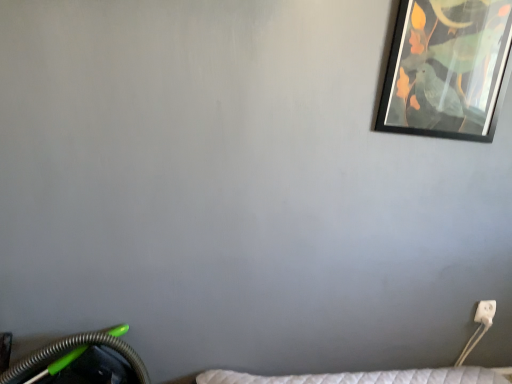
Question: Considering the relative sizes of white plastic electric outlet at lower right and black matte picture frame at upper right in the image provided, is white plastic electric outlet at lower right wider than black matte picture frame at upper right?

Choices:
 (A) no
 (B) yes

Answer: (A)

Question: Is white plastic electric outlet at lower right not inside black matte picture frame at upper right?

Choices:
 (A) no
 (B) yes

Answer: (B)

Question: Does white plastic electric outlet at lower right appear on the left side of black matte picture frame at upper right?

Choices:
 (A) yes
 (B) no

Answer: (B)

Question: Considering the relative sizes of white plastic electric outlet at lower right and black matte picture frame at upper right in the image provided, is white plastic electric outlet at lower right bigger than black matte picture frame at upper right?

Choices:
 (A) yes
 (B) no

Answer: (B)

Question: From the image's perspective, is white plastic electric outlet at lower right below black matte picture frame at upper right?

Choices:
 (A) yes
 (B) no

Answer: (A)

Question: Is white plastic electric outlet at lower right taller than black matte picture frame at upper right?

Choices:
 (A) yes
 (B) no

Answer: (B)

Question: Is black matte picture frame at upper right facing towards white plastic electric outlet at lower right?

Choices:
 (A) no
 (B) yes

Answer: (A)

Question: From a real-world perspective, is black matte picture frame at upper right under white plastic electric outlet at lower right?

Choices:
 (A) yes
 (B) no

Answer: (B)

Question: Would you say black matte picture frame at upper right is a long distance from white plastic electric outlet at lower right?

Choices:
 (A) no
 (B) yes

Answer: (A)

Question: Is black matte picture frame at upper right at the right side of white plastic electric outlet at lower right?

Choices:
 (A) yes
 (B) no

Answer: (B)

Question: Considering the relative positions of black matte picture frame at upper right and white plastic electric outlet at lower right in the image provided, is black matte picture frame at upper right in front of white plastic electric outlet at lower right?

Choices:
 (A) no
 (B) yes

Answer: (B)

Question: From a real-world perspective, is black matte picture frame at upper right on white plastic electric outlet at lower right?

Choices:
 (A) yes
 (B) no

Answer: (A)

Question: From the image's perspective, is white plastic electric outlet at lower right above or below black matte picture frame at upper right?

Choices:
 (A) above
 (B) below

Answer: (B)